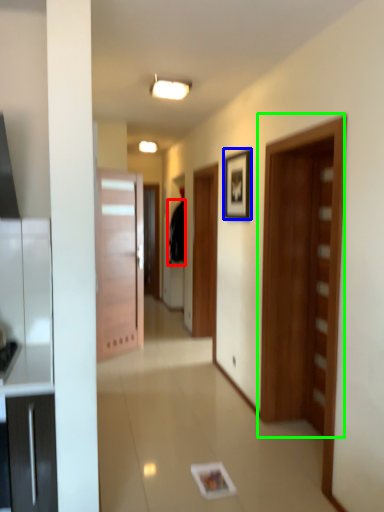
Question: Based on their relative distances, which object is nearer to robe (highlighted by a red box)? Choose from picture frame (highlighted by a blue box) and door (highlighted by a green box).

Choices:
 (A) picture frame
 (B) door

Answer: (A)